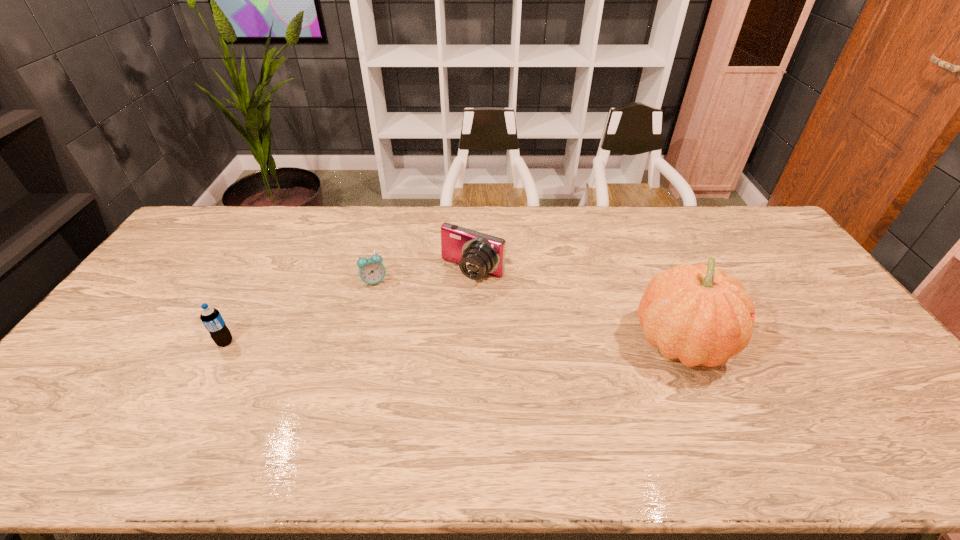
Identify the location of vacant area that lies between the soda bottle and the alarm clock. This screenshot has height=540, width=960. (300, 312).

You are a GUI agent. You are given a task and a screenshot of the screen. Output one action in this format:
    pyautogui.click(x=<x>, y=<y>)
    Task: Click on the free point between the tallest object and the soda bottle
    This screenshot has height=540, width=960.
    Given the screenshot: What is the action you would take?
    pyautogui.click(x=453, y=342)

Find the location of a particular element. free point between the camera and the shortest object is located at coordinates (423, 278).

This screenshot has width=960, height=540. What are the coordinates of `vacant area between the leftmost object and the shortest object` in the screenshot? It's located at (300, 312).

The image size is (960, 540). I want to click on vacant area that lies between the third object from left to right and the pumpkin, so click(x=577, y=307).

At what (x,y) coordinates should I click in order to perform the action: click on free spot between the rightmost object and the camera. Please return your answer as a coordinate pair (x, y). The width and height of the screenshot is (960, 540). Looking at the image, I should click on (577, 307).

Where is `empty location between the shortest object and the pumpkin`? Image resolution: width=960 pixels, height=540 pixels. empty location between the shortest object and the pumpkin is located at coordinates (528, 312).

Where is `free space between the second object from right to left and the rightmost object`? free space between the second object from right to left and the rightmost object is located at coordinates (577, 307).

Identify the location of vacant space that's between the second object from left to right and the leftmost object. (300, 312).

The width and height of the screenshot is (960, 540). Find the location of `object that can be found as the second closest to the pumpkin`. object that can be found as the second closest to the pumpkin is located at coordinates (371, 270).